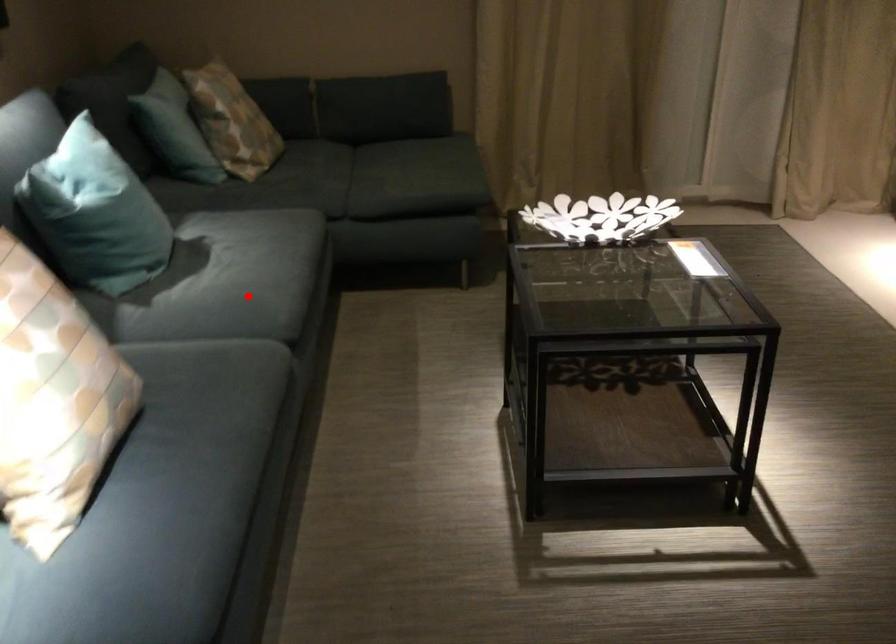
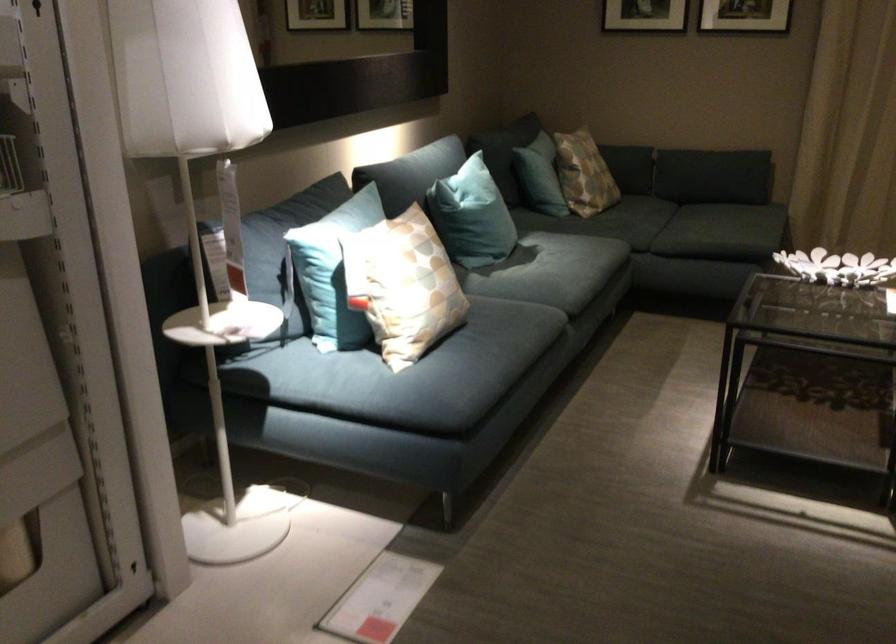
Question: I am providing you with two images of the same scene from different viewpoints. Image1 has a red point marked. In image2, the corresponding 3D location appears at what relative position? Reply with the corresponding letter.

Choices:
 (A) Closer
 (B) Farther

Answer: (B)